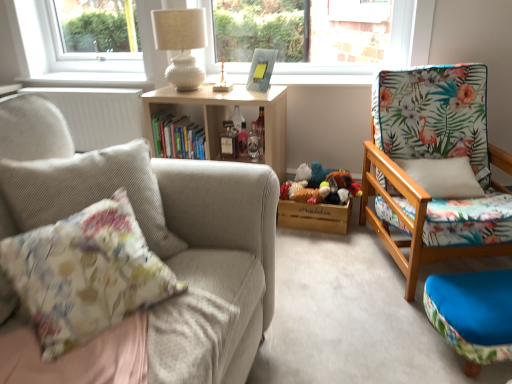
Question: Considering the relative positions of clear glass bottle at center, which is the 3th bottle in left-to-right order, and white ribbed radiator at left in the image provided, is clear glass bottle at center, which is the 3th bottle in left-to-right order, in front of white ribbed radiator at left?

Choices:
 (A) no
 (B) yes

Answer: (B)

Question: Is clear glass bottle at center, which appears as the first bottle when viewed from the right, turned away from white ribbed radiator at left?

Choices:
 (A) no
 (B) yes

Answer: (A)

Question: From a real-world perspective, is clear glass bottle at center, which is the 3th bottle in left-to-right order, beneath white ribbed radiator at left?

Choices:
 (A) no
 (B) yes

Answer: (A)

Question: Does clear glass bottle at center, which appears as the first bottle when viewed from the right, have a smaller size compared to white ribbed radiator at left?

Choices:
 (A) no
 (B) yes

Answer: (B)

Question: Is clear glass bottle at center, which is the 3th bottle in left-to-right order, not near white ribbed radiator at left?

Choices:
 (A) yes
 (B) no

Answer: (A)

Question: Does clear glass bottle at center, which appears as the first bottle when viewed from the right, have a larger size compared to white ribbed radiator at left?

Choices:
 (A) no
 (B) yes

Answer: (A)

Question: Is hardcover books at center to the right of clear glass bottle at center, which appears as the first bottle when viewed from the right, from the viewer's perspective?

Choices:
 (A) no
 (B) yes

Answer: (A)

Question: Does hardcover books at center turn towards clear glass bottle at center, which appears as the first bottle when viewed from the right?

Choices:
 (A) no
 (B) yes

Answer: (A)

Question: Does hardcover books at center have a lesser width compared to clear glass bottle at center, which appears as the first bottle when viewed from the right?

Choices:
 (A) yes
 (B) no

Answer: (B)

Question: Does hardcover books at center lie in front of clear glass bottle at center, which appears as the first bottle when viewed from the right?

Choices:
 (A) yes
 (B) no

Answer: (B)

Question: Can we say hardcover books at center lies outside clear glass bottle at center, which appears as the first bottle when viewed from the right?

Choices:
 (A) no
 (B) yes

Answer: (B)

Question: Is clear glass bottle at center, which is the 3th bottle in left-to-right order, located within hardcover books at center?

Choices:
 (A) yes
 (B) no

Answer: (B)

Question: Is clear glass bottle at center, which is the 3th bottle in left-to-right order, beside blue fabric ottoman at lower right?

Choices:
 (A) no
 (B) yes

Answer: (A)